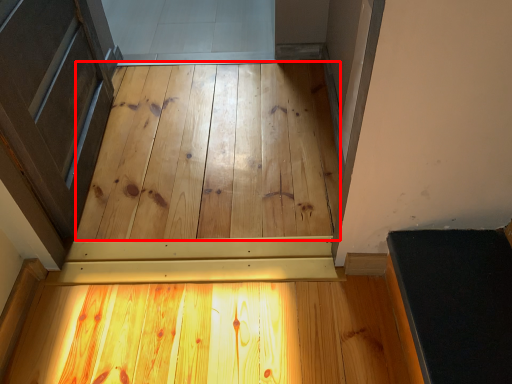
Question: Considering the relative positions of plywood (annotated by the red box) and plywood in the image provided, where is plywood (annotated by the red box) located with respect to the staircase?

Choices:
 (A) left
 (B) right

Answer: (A)